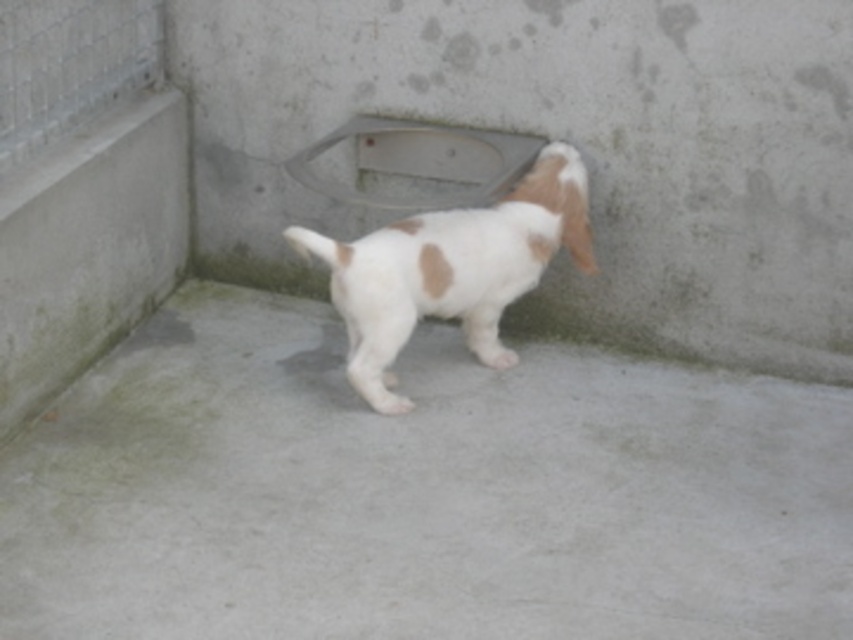
Question: Estimate the real-world distances between objects in this image. Which object is farther from the gray concrete at center?

Choices:
 (A) gray concrete pavement at center
 (B) white fur dog at center

Answer: (A)

Question: Considering the real-world distances, which object is closest to the white fur dog at center?

Choices:
 (A) gray concrete at center
 (B) gray concrete pavement at center

Answer: (A)

Question: Can you confirm if gray concrete pavement at center is positioned below gray concrete at center?

Choices:
 (A) yes
 (B) no

Answer: (A)

Question: In this image, where is gray concrete pavement at center located relative to gray concrete at center?

Choices:
 (A) above
 (B) below

Answer: (B)

Question: Which point appears closest to the camera in this image?

Choices:
 (A) (335, 305)
 (B) (271, 49)
 (C) (724, 536)

Answer: (C)

Question: Does gray concrete pavement at center appear over white fur dog at center?

Choices:
 (A) no
 (B) yes

Answer: (A)